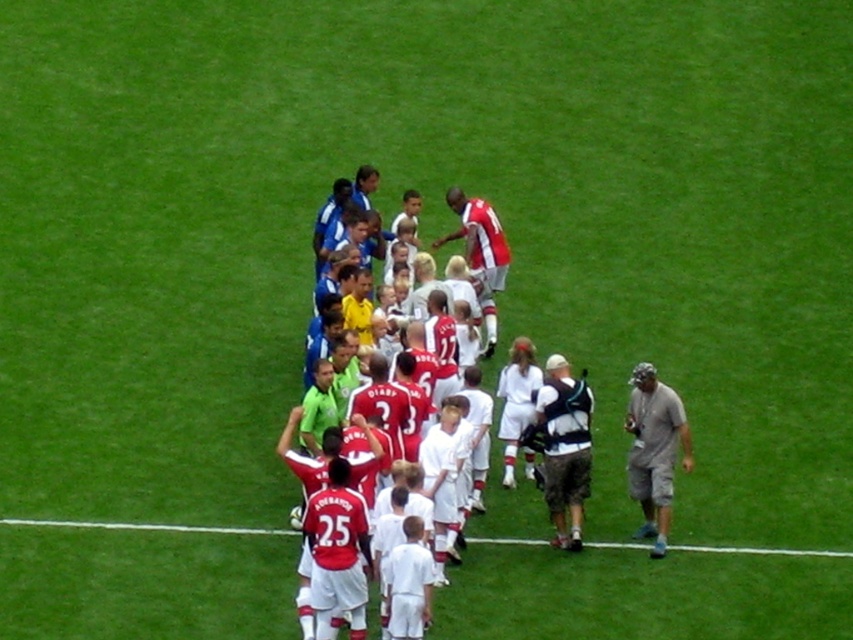
Question: Which point is farther to the camera?

Choices:
 (A) white mesh vest at center
 (B) white fabric at lower center
 (C) red jersey soccer players at center
 (D) gray fabric cap at lower right

Answer: (A)

Question: Does red jersey soccer players at center have a smaller size compared to white fabric at lower center?

Choices:
 (A) no
 (B) yes

Answer: (A)

Question: Considering the relative positions of white mesh vest at center and matte red soccer jersey at center in the image provided, where is white mesh vest at center located with respect to matte red soccer jersey at center?

Choices:
 (A) below
 (B) above

Answer: (A)

Question: Which is nearer to the gray fabric cap at lower right?

Choices:
 (A) white fabric at lower center
 (B) white mesh vest at center

Answer: (B)

Question: Is gray fabric cap at lower right positioned in front of matte red soccer jersey at center?

Choices:
 (A) no
 (B) yes

Answer: (B)

Question: Based on their relative distances, which object is farther from the white mesh vest at center?

Choices:
 (A) red jersey soccer players at center
 (B) matte red soccer jersey at center
 (C) white fabric at lower center

Answer: (B)